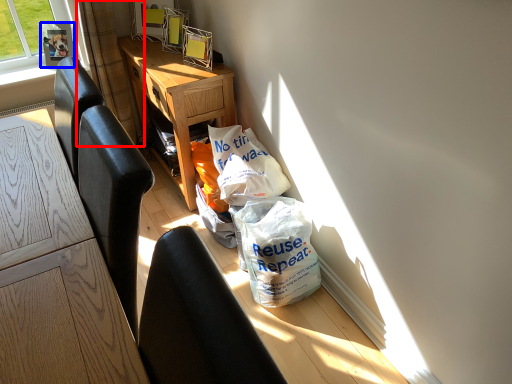
Question: Which point is closer to the camera, curtain (highlighted by a red box) or picture frame (highlighted by a blue box)?

Choices:
 (A) curtain
 (B) picture frame

Answer: (A)